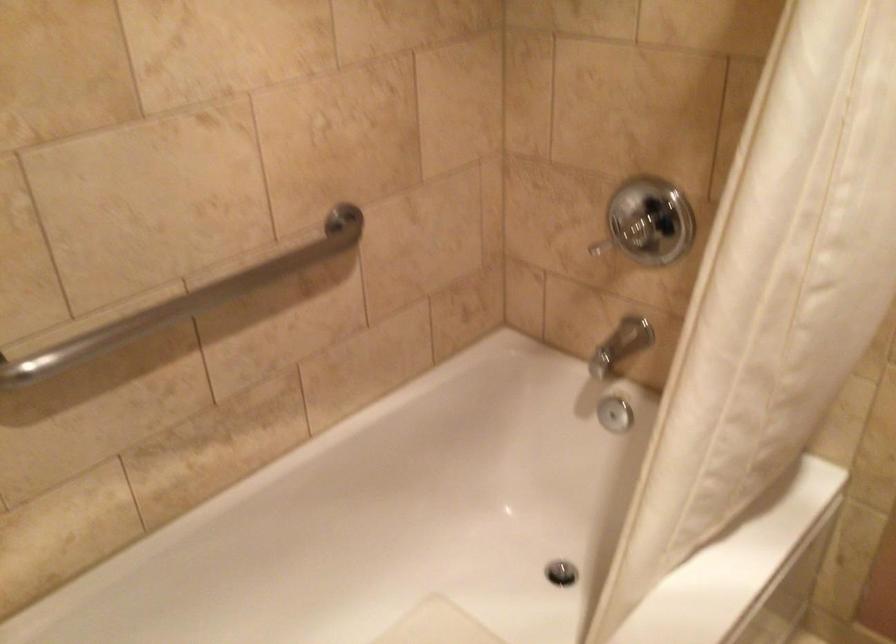
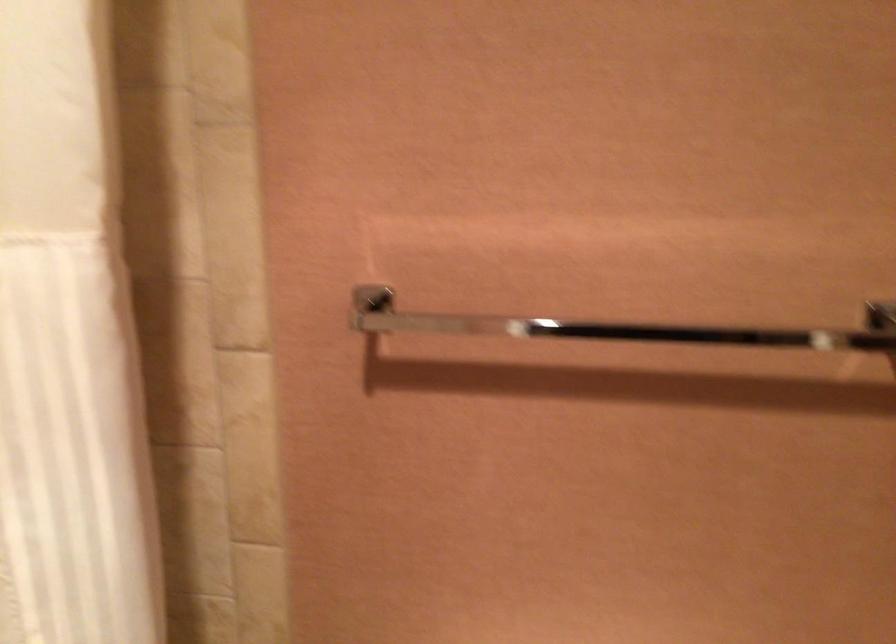
Question: Based on the continuous images, in which direction is the camera rotating? Reply with the corresponding letter.

Choices:
 (A) Left
 (B) Right
 (C) Up
 (D) Down

Answer: (B)